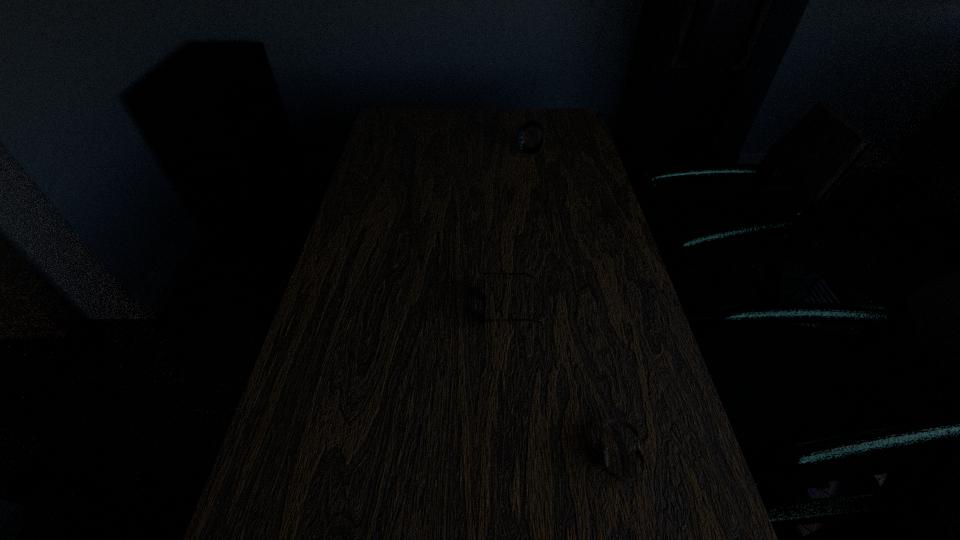
Where is `the farthest object`? the farthest object is located at coordinates (520, 132).

Find the location of a particular element. the taller watch is located at coordinates [520, 132].

Identify the location of the second farthest object. Image resolution: width=960 pixels, height=540 pixels. (484, 295).

At what (x,y) coordinates should I click in order to perform the action: click on the shorter watch. Please return your answer as a coordinate pair (x, y). Image resolution: width=960 pixels, height=540 pixels. Looking at the image, I should click on (602, 447).

I want to click on the nearer watch, so click(x=602, y=447).

At what (x,y) coordinates should I click in order to perform the action: click on free space located on the face of the tallest object. Please return your answer as a coordinate pair (x, y). The width and height of the screenshot is (960, 540). Looking at the image, I should click on (502, 152).

The width and height of the screenshot is (960, 540). I want to click on vacant point located 0.270m on the face of the tallest object, so click(440, 152).

Identify the location of blank space located 0.280m on the face of the tallest object. Image resolution: width=960 pixels, height=540 pixels. (437, 152).

The height and width of the screenshot is (540, 960). What are the coordinates of `free spot located 0.050m at the front view of the second nearest object` in the screenshot? It's located at (463, 308).

Find the location of a particular element. blank space located 0.320m at the front view of the second nearest object is located at coordinates (349, 308).